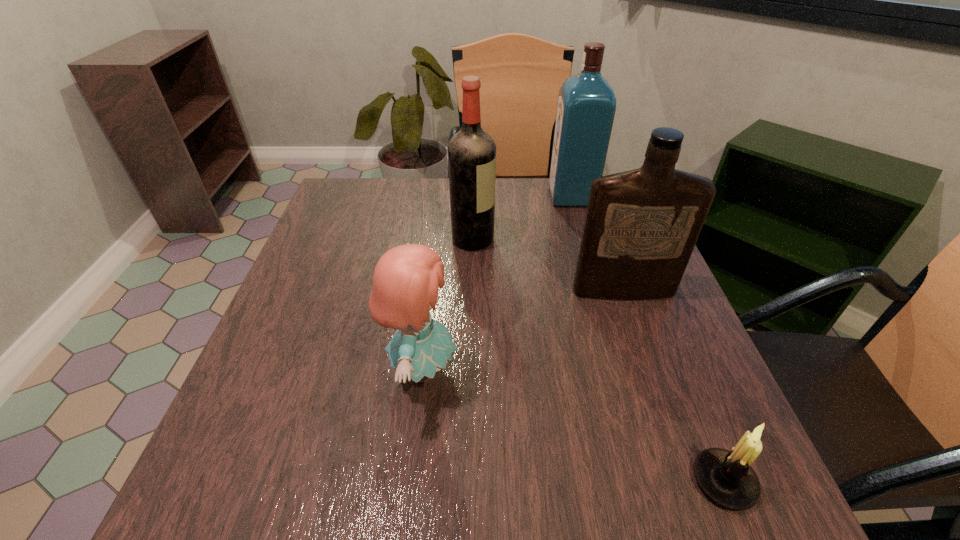
At what (x,y) coordinates should I click in order to perform the action: click on free space located on the flat label side of the farthest liquor. Please return your answer as a coordinate pair (x, y). This screenshot has height=540, width=960. Looking at the image, I should click on (452, 197).

Where is `vacant space situated on the front-facing side of the fourth nearest object`? This screenshot has height=540, width=960. vacant space situated on the front-facing side of the fourth nearest object is located at coordinates (605, 239).

Locate an element on the screen. vacant region located 0.320m on the label side of the third farthest object is located at coordinates (679, 449).

Locate an element on the screen. This screenshot has height=540, width=960. vacant area located 0.270m on the front-facing side of the fourth farthest object is located at coordinates (610, 369).

Where is `vacant region located 0.250m on the back of the shortest object`? This screenshot has height=540, width=960. vacant region located 0.250m on the back of the shortest object is located at coordinates (662, 328).

Identify the location of object that is at the near edge. This screenshot has width=960, height=540. (726, 477).

At what (x,y) coordinates should I click in order to perform the action: click on candle holder at the right edge. Please return your answer as a coordinate pair (x, y). The image size is (960, 540). Looking at the image, I should click on (726, 477).

Find the location of a particular element. object present at the far right corner is located at coordinates pos(586,107).

Where is `object that is at the near right corner`? The height and width of the screenshot is (540, 960). object that is at the near right corner is located at coordinates (726, 477).

The width and height of the screenshot is (960, 540). In the image, there is a desktop. What are the coordinates of `vacant space at the far edge` in the screenshot? It's located at (431, 191).